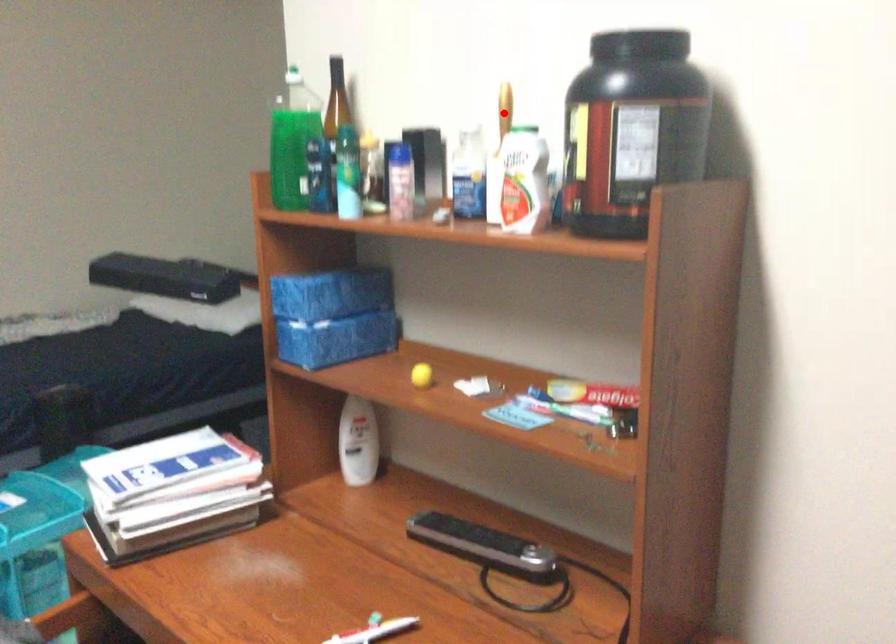
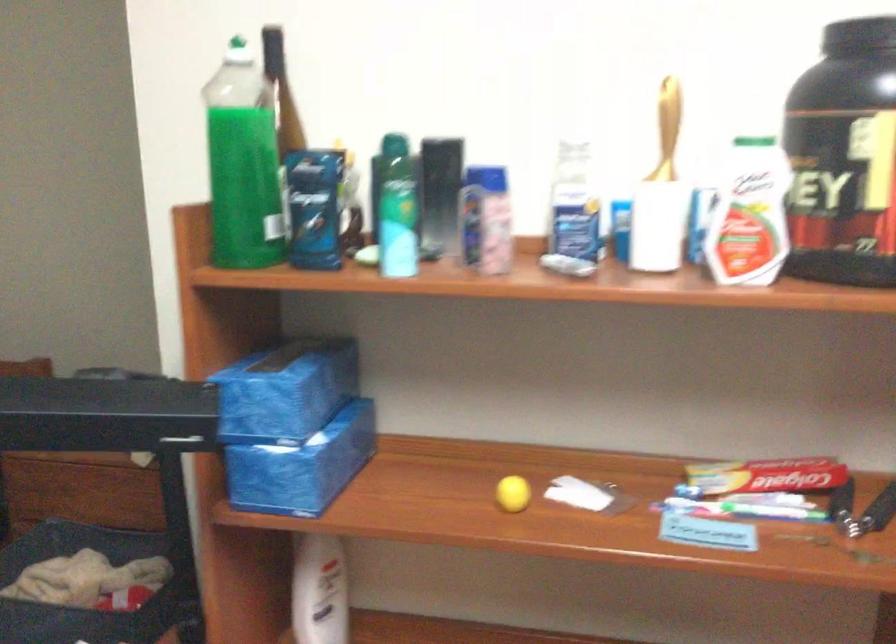
Locate, in the second image, the point that corresponds to the highlighted location in the first image.

(668, 118)